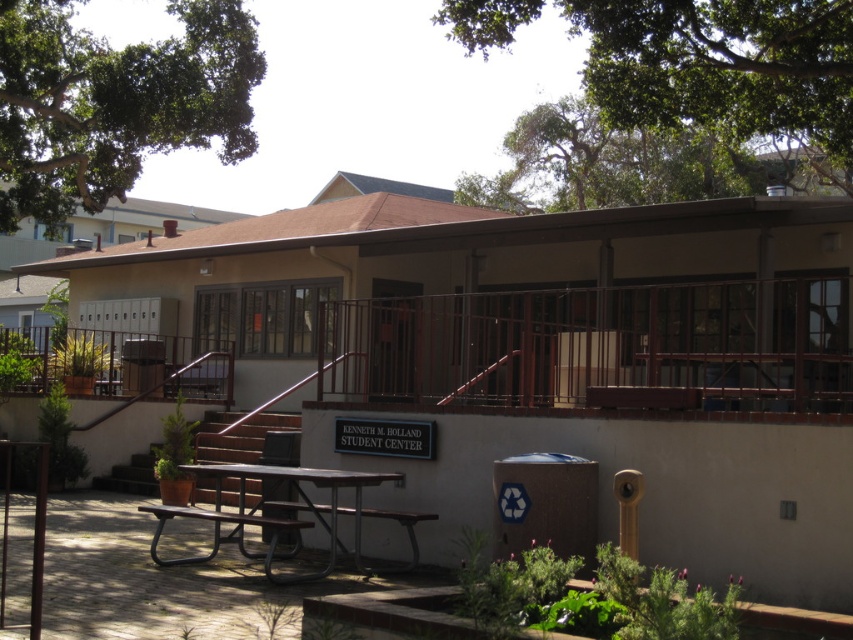
From the picture: You are standing in front of the Kenneth M. Holland Student Center and want to sit at the picnic tables. Which picnic table is closer to you, the brown metal picnic table at center or the metallic picnic table at lower center?

The brown metal picnic table at center is closer to you because it is further to the viewer than the metallic picnic table at lower center.

You are a student who needs to sit down quickly. You see the brown metal picnic table at center and the brown metal bench at center. Which one is taller and thus might be more comfortable for sitting?

The brown metal picnic table at center is much taller than the brown metal bench at center, so it might be more comfortable for sitting.